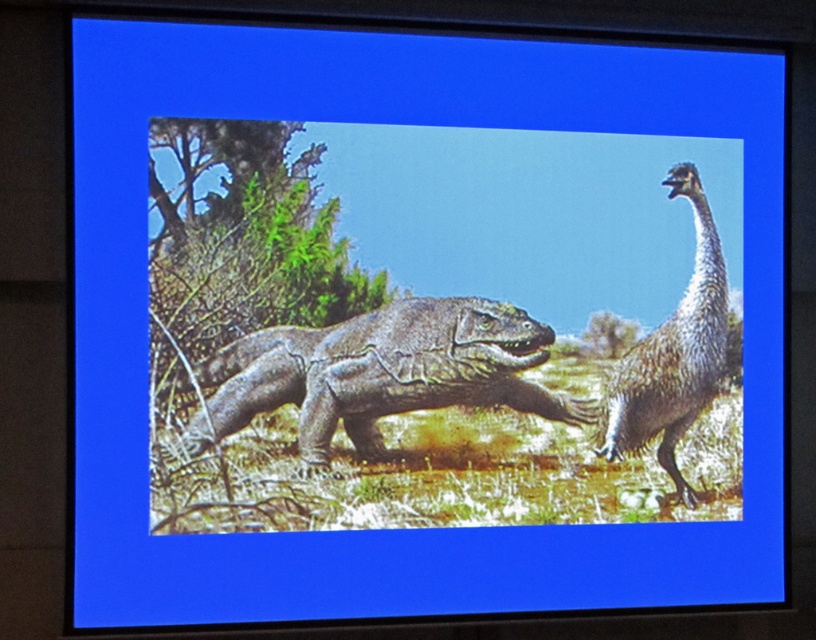
Is gray scaly dinosaur at center bigger than gray textured dinosaur at right?

Correct, gray scaly dinosaur at center is larger in size than gray textured dinosaur at right.

Where is `gray scaly dinosaur at center`? gray scaly dinosaur at center is located at coordinates (x=380, y=372).